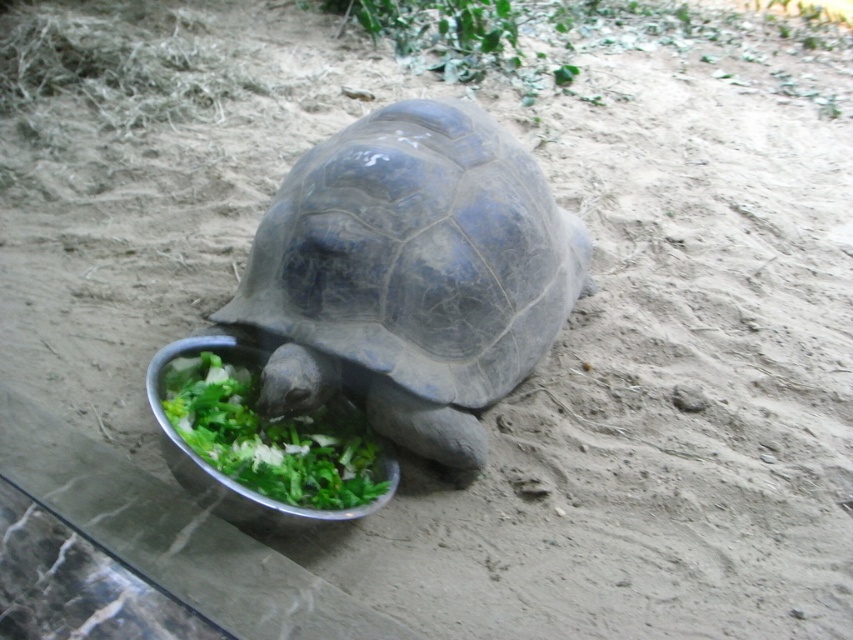
Question: Does smooth gray tortoise at center lie behind metallic silver bowl at lower center?

Choices:
 (A) no
 (B) yes

Answer: (B)

Question: From the image, what is the correct spatial relationship of smooth gray tortoise at center in relation to metallic silver bowl at lower center?

Choices:
 (A) above
 (B) below

Answer: (A)

Question: Which of the following is the farthest from the observer?

Choices:
 (A) (430, 348)
 (B) (227, 358)

Answer: (B)

Question: Observing the image, what is the correct spatial positioning of smooth gray tortoise at center in reference to metallic silver bowl at lower center?

Choices:
 (A) left
 (B) right

Answer: (B)

Question: Which of the following is the farthest from the observer?

Choices:
 (A) (236, 440)
 (B) (274, 237)

Answer: (B)